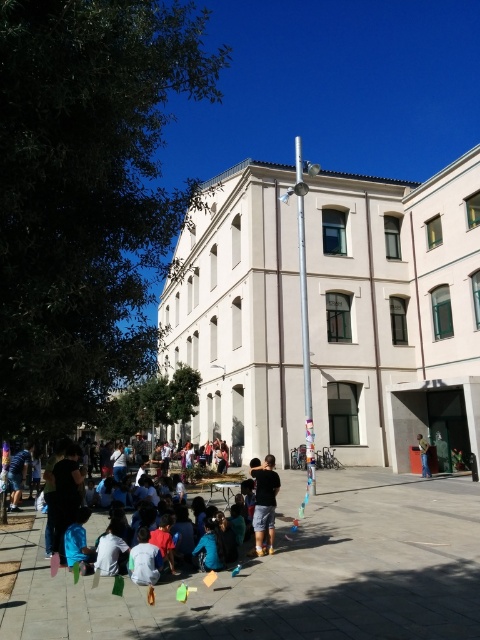
Question: Among these points, which one is nearest to the camera?

Choices:
 (A) (420, 436)
 (B) (272, 524)
 (C) (63, 522)

Answer: (C)

Question: Does blue cotton shirt at lower left have a greater width compared to denim jacket at lower right?

Choices:
 (A) yes
 (B) no

Answer: (A)

Question: Does silver metallic pole at center appear under dark blue shorts at center?

Choices:
 (A) no
 (B) yes

Answer: (A)

Question: Which point is closer to the camera?

Choices:
 (A) blue cotton shirt at lower left
 (B) dark blue shorts at center

Answer: (A)

Question: Can you confirm if blue cotton shirt at lower left is positioned to the right of dark blue shorts at center?

Choices:
 (A) no
 (B) yes

Answer: (A)

Question: Which object is the closest to the blue cotton shirt at lower left?

Choices:
 (A) dark blue shorts at center
 (B) denim jacket at lower right

Answer: (A)